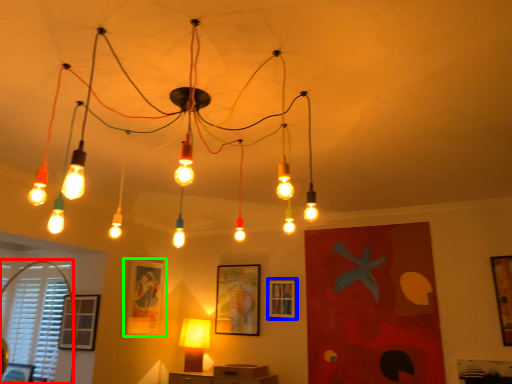
Question: Which is nearer to the window (highlighted by a red box)? picture frame (highlighted by a blue box) or picture frame (highlighted by a green box).

Choices:
 (A) picture frame
 (B) picture frame

Answer: (B)